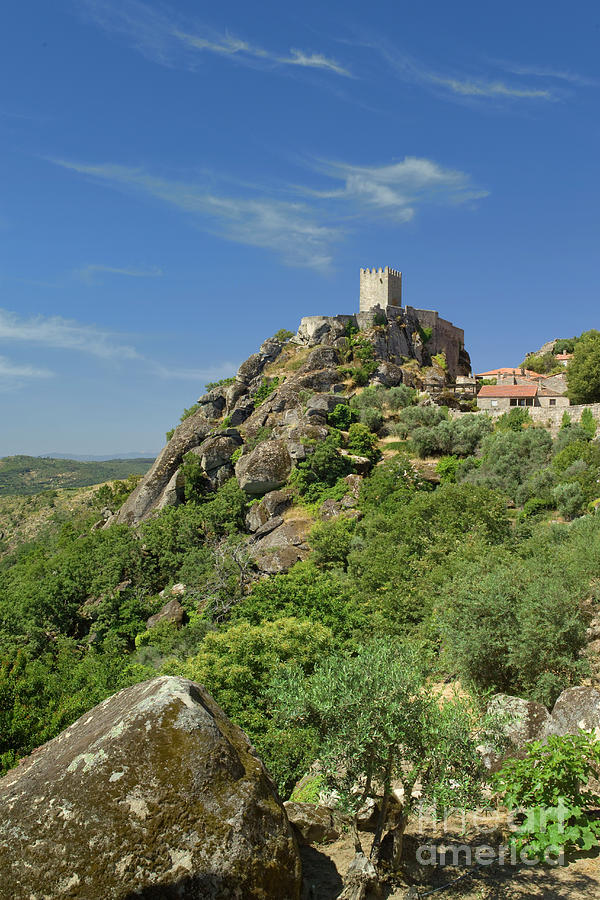
Where is `windows`? The image size is (600, 900). windows is located at coordinates (552, 400), (528, 402), (515, 400).